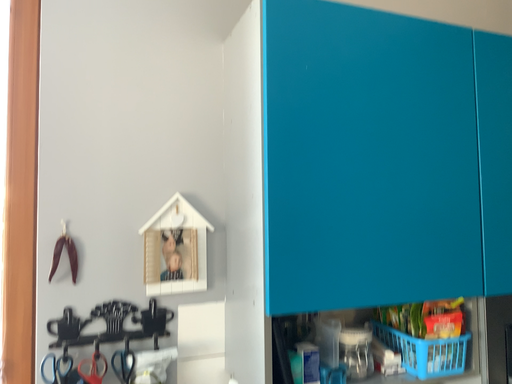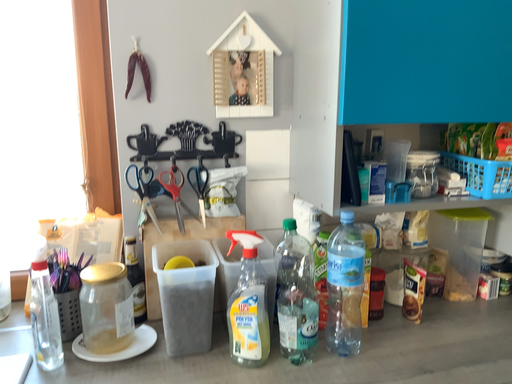
Question: Which way did the camera rotate in the video?

Choices:
 (A) rotated downward
 (B) rotated upward

Answer: (A)